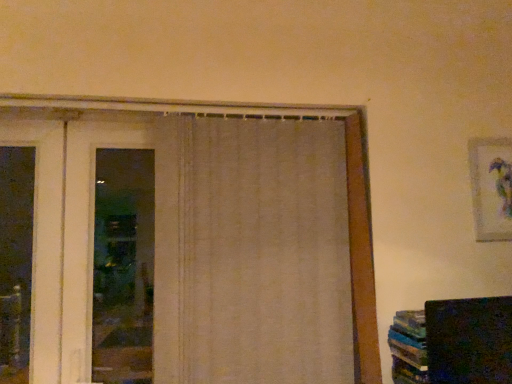
Question: Is beige fabric curtain at center bigger than white fabric door at left?

Choices:
 (A) no
 (B) yes

Answer: (B)

Question: Considering the relative positions of beige fabric curtain at center and white fabric door at left in the image provided, is beige fabric curtain at center to the right of white fabric door at left from the viewer's perspective?

Choices:
 (A) no
 (B) yes

Answer: (B)

Question: From a real-world perspective, is beige fabric curtain at center located higher than white fabric door at left?

Choices:
 (A) no
 (B) yes

Answer: (A)

Question: Does beige fabric curtain at center have a smaller size compared to white fabric door at left?

Choices:
 (A) yes
 (B) no

Answer: (B)

Question: Is beige fabric curtain at center next to white fabric door at left?

Choices:
 (A) no
 (B) yes

Answer: (A)

Question: From the image's perspective, would you say beige fabric curtain at center is positioned over white fabric door at left?

Choices:
 (A) no
 (B) yes

Answer: (A)

Question: Is white fabric door at left located outside matte white picture frame at upper right?

Choices:
 (A) no
 (B) yes

Answer: (B)

Question: Does white fabric door at left have a larger size compared to matte white picture frame at upper right?

Choices:
 (A) yes
 (B) no

Answer: (A)

Question: From the image's perspective, is white fabric door at left located beneath matte white picture frame at upper right?

Choices:
 (A) no
 (B) yes

Answer: (B)

Question: Considering the relative sizes of white fabric door at left and matte white picture frame at upper right in the image provided, is white fabric door at left taller than matte white picture frame at upper right?

Choices:
 (A) no
 (B) yes

Answer: (B)

Question: Does white fabric door at left have a greater width compared to matte white picture frame at upper right?

Choices:
 (A) no
 (B) yes

Answer: (B)

Question: Considering the relative positions of white fabric door at left and matte white picture frame at upper right in the image provided, is white fabric door at left to the left of matte white picture frame at upper right from the viewer's perspective?

Choices:
 (A) yes
 (B) no

Answer: (A)

Question: From the image's perspective, is white fabric door at left over beige fabric curtain at center?

Choices:
 (A) yes
 (B) no

Answer: (A)